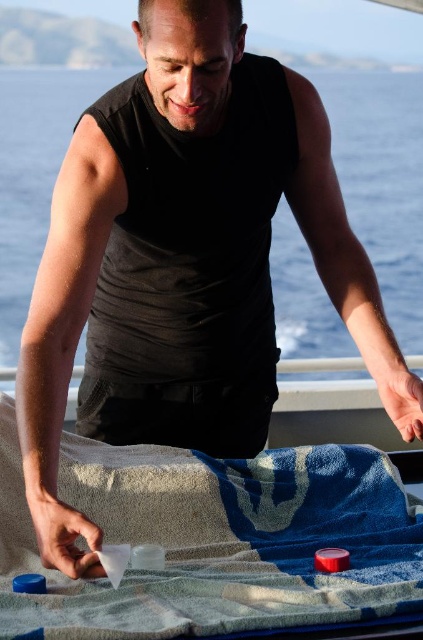
Which is in front, point (257, 564) or point (409, 314)?

Point (257, 564) is in front.

Is blue textured towel at lower center bigger than black matte towel at lower center?

No.

Locate an element on the screen. The image size is (423, 640). blue textured towel at lower center is located at coordinates (216, 540).